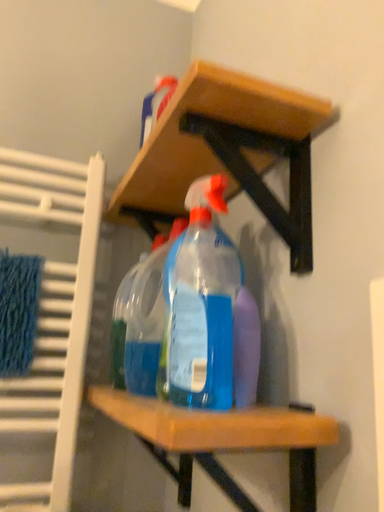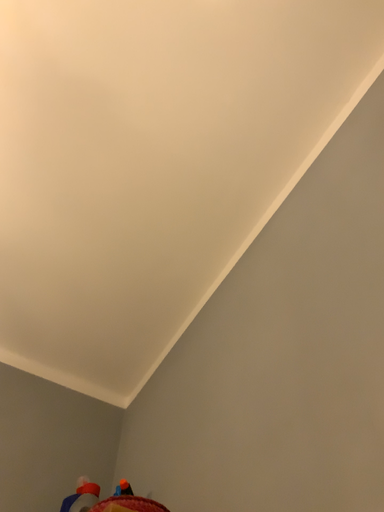
Question: How did the camera likely rotate when shooting the video?

Choices:
 (A) rotated upward
 (B) rotated downward

Answer: (A)